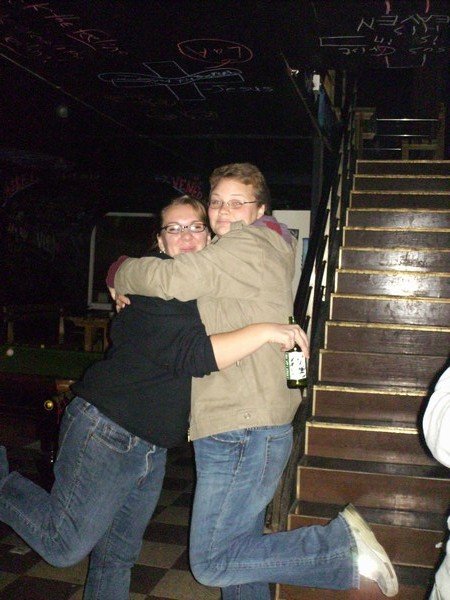
In order to click on ceiling with artwork in this screenshot , I will do `click(210, 66)`.